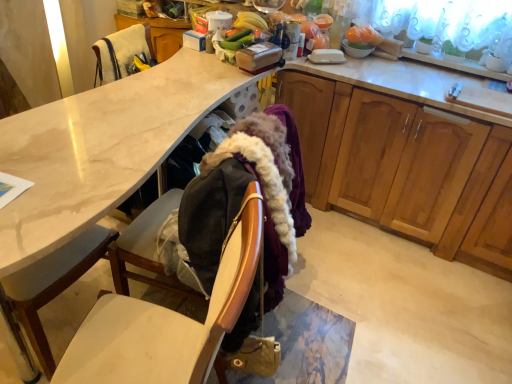
Locate an element on the screen. free space between white glossy bowl at upper right and green matte plant at upper right is located at coordinates coord(394,63).